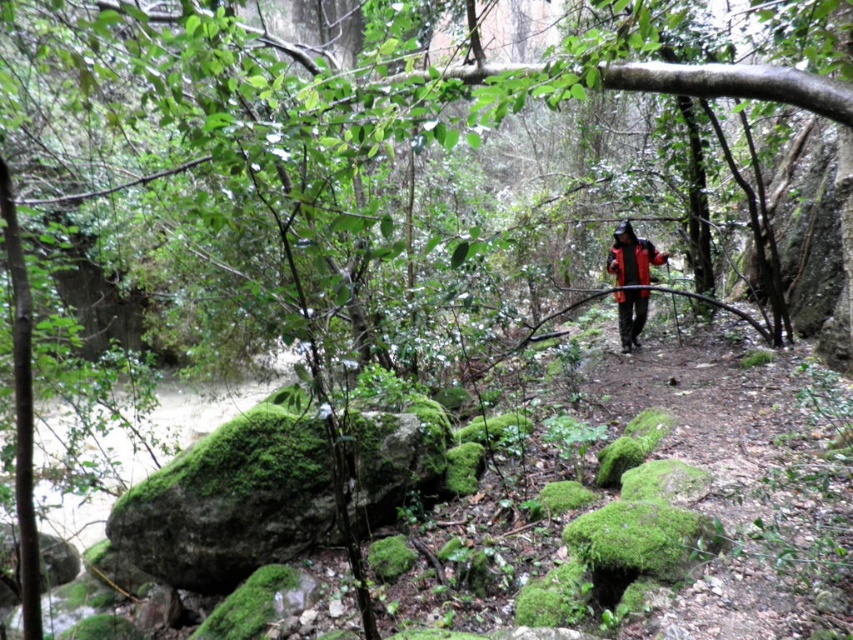
You are a hiker who wants to take a photo of the red matte jacket at center without the green mossy rock at lower left appearing in the frame. Which direction should you move to achieve this?

The green mossy rock at lower left is below the red matte jacket at center. To avoid the rock in the photo, you should move upwards or to the right so that the red matte jacket at center is positioned above the green mossy rock at lower left.

You are a hiker who wants to step over the green mossy rock at lower left while wearing the red matte jacket at center. Can you safely step over the rock without the jacket getting caught?

The green mossy rock at lower left is shorter than the red matte jacket at center, so stepping over it might cause the jacket to get caught. It is safer to move around the rock instead.